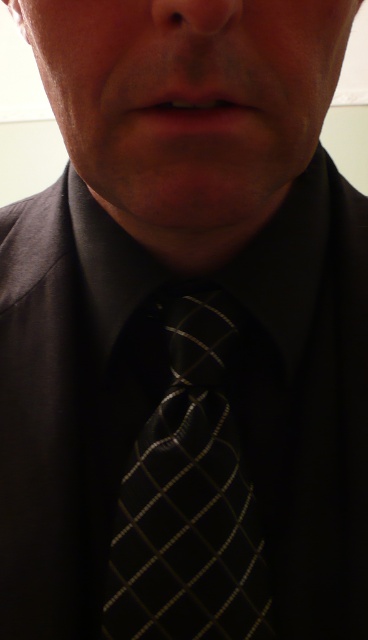
Question: Is the position of matte black tie at center more distant than that of matte skin nose at center?

Choices:
 (A) no
 (B) yes

Answer: (B)

Question: Can you confirm if matte black tie at center is positioned above matte skin nose at center?

Choices:
 (A) no
 (B) yes

Answer: (B)

Question: Which point is closer to the camera taking this photo?

Choices:
 (A) (54, 138)
 (B) (161, 4)

Answer: (B)

Question: Which of these objects is positioned farthest from the matte skin nose at center?

Choices:
 (A) black textured tie at center
 (B) matte black tie at center

Answer: (B)

Question: Among these objects, which one is farthest from the camera?

Choices:
 (A) matte black tie at center
 (B) black textured tie at center
 (C) matte skin nose at center

Answer: (A)

Question: Does black textured tie at center come behind matte black tie at center?

Choices:
 (A) yes
 (B) no

Answer: (B)